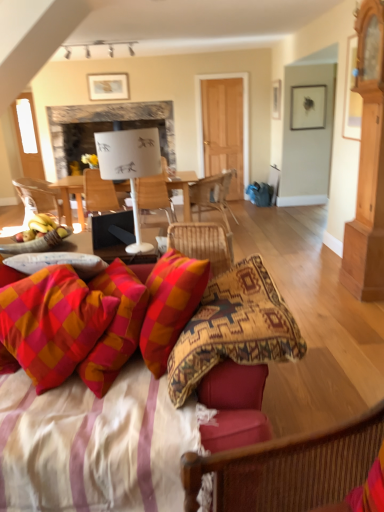
Describe the element at coordinates (119, 437) in the screenshot. This screenshot has width=384, height=512. I see `textured fabric couch at lower center` at that location.

Measure the distance between matte black picture frame at upper right, the second picture frame in the top-to-bottom sequence, and camera.

They are 20.13 feet apart.

How much space does matte gold picture frame at upper center, placed as the 2th picture frame when sorted from bottom to top, occupy horizontally?

1.37 inches.

You are a GUI agent. You are given a task and a screenshot of the screen. Output one action in this format:
    pyautogui.click(x=<x>, y=<y>)
    Task: Click on the woven wood chair at center, the third chair viewed from the left
    
    Given the screenshot: What is the action you would take?
    pyautogui.click(x=202, y=243)

From a real-world perspective, is matte gold picture frame at upper center, arranged as the first picture frame when viewed from the back, under matte black picture frame at upper right, acting as the first picture frame starting from the bottom?

Actually, matte gold picture frame at upper center, arranged as the first picture frame when viewed from the back, is physically above matte black picture frame at upper right, acting as the first picture frame starting from the bottom, in the real world.

Considering the relative sizes of matte gold picture frame at upper center, the second picture frame when ordered from right to left, and matte black picture frame at upper right, the second picture frame in the back-to-front sequence, in the image provided, is matte gold picture frame at upper center, the second picture frame when ordered from right to left, wider than matte black picture frame at upper right, the second picture frame in the back-to-front sequence,?

In fact, matte gold picture frame at upper center, the second picture frame when ordered from right to left, might be narrower than matte black picture frame at upper right, the second picture frame in the back-to-front sequence.

From the picture: How different are the orientations of matte gold picture frame at upper center, which is counted as the first picture frame, starting from the top, and matte black picture frame at upper right, the 2th picture frame positioned from the left, in degrees?

The angle between the facing direction of matte gold picture frame at upper center, which is counted as the first picture frame, starting from the top, and the facing direction of matte black picture frame at upper right, the 2th picture frame positioned from the left, is 0.237 degrees.

Which of these two, matte gold picture frame at upper center, placed as the 2th picture frame when sorted from bottom to top, or matte black picture frame at upper right, acting as the first picture frame starting from the bottom, is smaller?

matte gold picture frame at upper center, placed as the 2th picture frame when sorted from bottom to top.

Does point (214, 242) lie behind point (70, 356)?

Yes, it is.

At what (x,y) coordinates should I click in order to perform the action: click on the 1st chair above the plaid fabric pillow at lower left (from the image's perspective). Please return your answer as a coordinate pair (x, y). Looking at the image, I should click on (202, 243).

From the image's perspective, is woven wood chair at center, acting as the 2th chair starting from the right, located above or below plaid fabric pillow at lower left?

Clearly, from the image's perspective, woven wood chair at center, acting as the 2th chair starting from the right, is above plaid fabric pillow at lower left.

Does woven wood chair at center, acting as the 2th chair starting from the right, have a greater width compared to plaid fabric pillow at lower left?

In fact, woven wood chair at center, acting as the 2th chair starting from the right, might be narrower than plaid fabric pillow at lower left.

Which of these two, woven wood chair at center, positioned as the first chair in front-to-back order, or yellow bananas at left, is thinner?

woven wood chair at center, positioned as the first chair in front-to-back order, is thinner.

Which of these two, woven wood chair at center, acting as the 2th chair starting from the right, or yellow bananas at left, stands taller?

woven wood chair at center, acting as the 2th chair starting from the right, is taller.

You are a GUI agent. You are given a task and a screenshot of the screen. Output one action in this format:
    pyautogui.click(x=<x>, y=<y>)
    Task: Click on the fruit that is on the left side of woven wood chair at center, positioned as the first chair in front-to-back order
    The width and height of the screenshot is (384, 512).
    Given the screenshot: What is the action you would take?
    pyautogui.click(x=43, y=230)

Is woven wood chair at center, acting as the 2th chair starting from the right, inside the boundaries of yellow bananas at left, or outside?

woven wood chair at center, acting as the 2th chair starting from the right, is spatially situated outside yellow bananas at left.

From their relative heights in the image, would you say yellow bananas at left is taller or shorter than matte gold picture frame at upper center, positioned as the first picture frame in left-to-right order?

In the image, yellow bananas at left appears to be shorter than matte gold picture frame at upper center, positioned as the first picture frame in left-to-right order.

Is yellow bananas at left positioned with its back to matte gold picture frame at upper center, positioned as the first picture frame in left-to-right order?

yellow bananas at left does not have its back to matte gold picture frame at upper center, positioned as the first picture frame in left-to-right order.

Can we say textured fabric couch at lower center lies outside woven wood chair at center, marked as the first chair in a right-to-left arrangement?

That's correct, textured fabric couch at lower center is outside of woven wood chair at center, marked as the first chair in a right-to-left arrangement.

Is textured fabric couch at lower center closer to camera compared to woven wood chair at center, marked as the first chair in a right-to-left arrangement?

Yes, textured fabric couch at lower center is in front of woven wood chair at center, marked as the first chair in a right-to-left arrangement.

How many degrees apart are the facing directions of textured fabric couch at lower center and woven wood chair at center, marked as the first chair in a right-to-left arrangement?

The angle between the facing direction of textured fabric couch at lower center and the facing direction of woven wood chair at center, marked as the first chair in a right-to-left arrangement, is 106 degrees.

Considering the positions of objects textured fabric couch at lower center and woven wood chair at center, which is counted as the fourth chair, starting from the front, in the image provided, who is more to the left, textured fabric couch at lower center or woven wood chair at center, which is counted as the fourth chair, starting from the front,?

From the viewer's perspective, textured fabric couch at lower center appears more on the left side.

Consider the image. Based on their sizes in the image, would you say wooden chair at center, arranged as the third chair when viewed from the right, is bigger or smaller than woven wood chair at center, marked as the first chair in a right-to-left arrangement?

wooden chair at center, arranged as the third chair when viewed from the right, is smaller than woven wood chair at center, marked as the first chair in a right-to-left arrangement.

Is wooden chair at center, placed as the 3th chair when sorted from back to front, at the right side of woven wood chair at center, which is counted as the fourth chair, starting from the front?

Incorrect, wooden chair at center, placed as the 3th chair when sorted from back to front, is not on the right side of woven wood chair at center, which is counted as the fourth chair, starting from the front.

How many degrees apart are the facing directions of wooden chair at center, placed as the 3th chair when sorted from back to front, and woven wood chair at center, which is the first chair from back to front?

They differ by 70.6 degrees in their facing directions.

Which point is more forward, (x=175, y=217) or (x=214, y=179)?

The point (x=175, y=217) is closer.

Could you measure the distance between matte gold picture frame at upper center, which is counted as the first picture frame, starting from the top, and woven wood chair at center, which is the first chair from back to front?

They are 8.43 feet apart.

Starting from the matte gold picture frame at upper center, the second picture frame when ordered from front to back, which chair is the 3rd one to the right? Please provide its 2D coordinates.

[(212, 194)]

From a real-world perspective, which object rests below the other?

In real-world perspective, woven wood chair at center, marked as the first chair in a right-to-left arrangement, is lower.

Is matte gold picture frame at upper center, arranged as the first picture frame when viewed from the back, further to camera compared to woven wood chair at center, which is counted as the fourth chair, starting from the front?

Yes, the depth of matte gold picture frame at upper center, arranged as the first picture frame when viewed from the back, is greater than that of woven wood chair at center, which is counted as the fourth chair, starting from the front.

Where is `picture frame positioned vertically above the matte black picture frame at upper right, the second picture frame in the back-to-front sequence (from a real-world perspective)`? The image size is (384, 512). picture frame positioned vertically above the matte black picture frame at upper right, the second picture frame in the back-to-front sequence (from a real-world perspective) is located at coordinates (108, 86).

Locate an element on the screen. This screenshot has height=512, width=384. chair that is the 1st object located above the plaid fabric pillow at lower left (from the image's perspective) is located at coordinates (202, 243).

From the picture: Considering their positions, is woven wood chair at center, the third chair viewed from the left, positioned closer to white paperboard at center than yellow bananas at left?

yellow bananas at left.

Looking at the image, which one is located further to wooden woven chair at left, placed as the fourth chair when sorted from right to left, matte gold picture frame at upper center, the second picture frame when ordered from front to back, or textured fabric couch at lower center?

textured fabric couch at lower center is positioned further to the anchor wooden woven chair at left, placed as the fourth chair when sorted from right to left.

When comparing their distances from matte black picture frame at upper right, which is the first picture frame in right-to-left order, does white paperboard at center or yellow bananas at left seem further?

Among the two, yellow bananas at left is located further to matte black picture frame at upper right, which is the first picture frame in right-to-left order.

When comparing their distances from wooden chair at center, arranged as the third chair when viewed from the right, does woven wood chair at center, positioned as the first chair in front-to-back order, or matte gold picture frame at upper center, arranged as the first picture frame when viewed from the back, seem closer?

matte gold picture frame at upper center, arranged as the first picture frame when viewed from the back.

Based on their spatial positions, is woven wood chair at center, which is the first chair from back to front, or white paperboard at center closer to yellow bananas at left?

Based on the image, woven wood chair at center, which is the first chair from back to front, appears to be nearer to yellow bananas at left.

Estimate the real-world distances between objects in this image. Which object is further from woven wood chair at center, marked as the first chair in a right-to-left arrangement, yellow bananas at left or textured fabric couch at lower center?

The object further to woven wood chair at center, marked as the first chair in a right-to-left arrangement, is textured fabric couch at lower center.

Looking at the image, which one is located further to wooden woven chair at left, the third chair viewed from the front, textured fabric couch at lower center or wooden chair at center, arranged as the third chair when viewed from the right?

textured fabric couch at lower center is positioned further to the anchor wooden woven chair at left, the third chair viewed from the front.

From the image, which object appears to be nearer to woven wood chair at center, marked as the fourth chair in a left-to-right arrangement, white paperboard at center or woven wood chair at center, acting as the 2th chair starting from the right?

The object closer to woven wood chair at center, marked as the fourth chair in a left-to-right arrangement, is white paperboard at center.

The height and width of the screenshot is (512, 384). Identify the location of fruit between plaid fabric pillow at lower left and wooden woven chair at left, the 2th chair in the back-to-front sequence, from front to back. pyautogui.click(x=43, y=230).

The image size is (384, 512). Identify the location of picture frame between plaid fabric pillow at lower left and matte gold picture frame at upper center, placed as the 2th picture frame when sorted from bottom to top, from front to back. (308, 106).

I want to click on fruit between textured fabric couch at lower center and matte black picture frame at upper right, the 2th picture frame positioned from the left, in the front-back direction, so click(x=43, y=230).

Where is `fruit located between textured fabric couch at lower center and matte gold picture frame at upper center, the second picture frame when ordered from right to left, in the depth direction`? This screenshot has height=512, width=384. fruit located between textured fabric couch at lower center and matte gold picture frame at upper center, the second picture frame when ordered from right to left, in the depth direction is located at coordinates (43, 230).